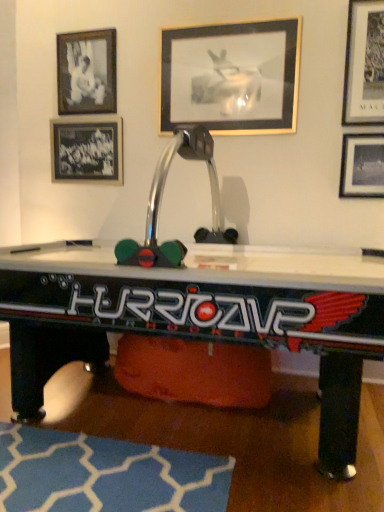
The height and width of the screenshot is (512, 384). Find the location of `metallic silver picture frame at upper right, which is the 2th picture frame in right-to-left order`. metallic silver picture frame at upper right, which is the 2th picture frame in right-to-left order is located at coordinates (364, 64).

Based on the photo, what is the approximate width of metallic silver air hockey table at center?

4.19 feet.

Find the location of a particular element. This screenshot has height=512, width=384. metallic silver air hockey table at center is located at coordinates (198, 316).

Measure the distance between metallic silver picture frame at upper center, the 3th picture frame when ordered from right to left, and camera.

A distance of 2.46 meters exists between metallic silver picture frame at upper center, the 3th picture frame when ordered from right to left, and camera.

Image resolution: width=384 pixels, height=512 pixels. I want to click on metallic silver picture frame at upper right, positioned as the 4th picture frame in left-to-right order, so click(x=364, y=64).

Does point (80, 479) lie behind point (54, 129)?

No, (80, 479) is in front of (54, 129).

Would you say blue fabric rug at lower center is outside black glass picture frame at upper left, the 1th picture frame when ordered from left to right?

Yes, blue fabric rug at lower center is not within black glass picture frame at upper left, the 1th picture frame when ordered from left to right.

Is blue fabric rug at lower center next to black glass picture frame at upper left, the 1th picture frame when ordered from left to right?

blue fabric rug at lower center and black glass picture frame at upper left, the 1th picture frame when ordered from left to right, are not in contact.

At what (x,y) coordinates should I click in order to perform the action: click on the 2nd picture frame above the blue fabric rug at lower center (from the image's perspective). Please return your answer as a coordinate pair (x, y). The height and width of the screenshot is (512, 384). Looking at the image, I should click on (87, 148).

Considering the positions of objects metallic silver air hockey table at center and black glass picture frame at upper left, the 1th picture frame when ordered from left to right, in the image provided, who is more to the left, metallic silver air hockey table at center or black glass picture frame at upper left, the 1th picture frame when ordered from left to right,?

From the viewer's perspective, black glass picture frame at upper left, the 1th picture frame when ordered from left to right, appears more on the left side.

Is black glass picture frame at upper left, marked as the 5th picture frame in a right-to-left arrangement, completely or partially inside metallic silver air hockey table at center?

Yes, black glass picture frame at upper left, marked as the 5th picture frame in a right-to-left arrangement, is a part of metallic silver air hockey table at center.

Is black glass picture frame at upper left, the 1th picture frame when ordered from left to right, at the back of metallic silver air hockey table at center?

Absolutely, metallic silver air hockey table at center is directed away from black glass picture frame at upper left, the 1th picture frame when ordered from left to right.

Does metallic silver air hockey table at center come behind black glass picture frame at upper left, marked as the 5th picture frame in a right-to-left arrangement?

No, it is not.

Find the location of `table on the right of black matte photo frame at upper left, positioned as the 2th picture frame in left-to-right order`. table on the right of black matte photo frame at upper left, positioned as the 2th picture frame in left-to-right order is located at coordinates click(x=198, y=316).

In terms of width, does black matte photo frame at upper left, the fourth picture frame when ordered from right to left, look wider or thinner when compared to metallic silver air hockey table at center?

Considering their sizes, black matte photo frame at upper left, the fourth picture frame when ordered from right to left, looks slimmer than metallic silver air hockey table at center.

Is black matte photo frame at upper left, the fourth picture frame when ordered from right to left, touching metallic silver air hockey table at center?

No, black matte photo frame at upper left, the fourth picture frame when ordered from right to left, is not next to metallic silver air hockey table at center.

Could you tell me if black matte photo frame at upper left, positioned as the 2th picture frame in left-to-right order, is turned towards metallic silver air hockey table at center?

No, black matte photo frame at upper left, positioned as the 2th picture frame in left-to-right order, is not turned towards metallic silver air hockey table at center.

Between metallic silver picture frame at upper right, marked as the 5th picture frame in a left-to-right arrangement, and metallic silver picture frame at upper center, the 3th picture frame when ordered from right to left, which one has larger size?

With larger size is metallic silver picture frame at upper center, the 3th picture frame when ordered from right to left.

What's the angular difference between metallic silver picture frame at upper right, placed as the 1th picture frame when sorted from right to left, and metallic silver picture frame at upper center, the third picture frame when ordered from left to right,'s facing directions?

They differ by 0.016 degrees in their facing directions.

Considering the positions of objects metallic silver picture frame at upper right, placed as the 1th picture frame when sorted from right to left, and metallic silver picture frame at upper center, the 3th picture frame when ordered from right to left, in the image provided, who is more to the right, metallic silver picture frame at upper right, placed as the 1th picture frame when sorted from right to left, or metallic silver picture frame at upper center, the 3th picture frame when ordered from right to left,?

Positioned to the right is metallic silver picture frame at upper right, placed as the 1th picture frame when sorted from right to left.

Where is `the 1st picture frame behind the metallic silver picture frame at upper right, placed as the 1th picture frame when sorted from right to left, counting from the anchor's position`? the 1st picture frame behind the metallic silver picture frame at upper right, placed as the 1th picture frame when sorted from right to left, counting from the anchor's position is located at coordinates (232, 77).

In the image, is metallic silver picture frame at upper center, the third picture frame when ordered from left to right, on the left side or the right side of black matte photo frame at upper left, positioned as the 2th picture frame in left-to-right order?

From the image, it's evident that metallic silver picture frame at upper center, the third picture frame when ordered from left to right, is to the right of black matte photo frame at upper left, positioned as the 2th picture frame in left-to-right order.

Which of these two, metallic silver picture frame at upper center, the third picture frame when ordered from left to right, or black matte photo frame at upper left, positioned as the 2th picture frame in left-to-right order, is bigger?

With larger size is metallic silver picture frame at upper center, the third picture frame when ordered from left to right.

From a real-world perspective, is metallic silver picture frame at upper center, the 3th picture frame when ordered from right to left, positioned under black matte photo frame at upper left, positioned as the 2th picture frame in left-to-right order, based on gravity?

Yes, from a real-world perspective, metallic silver picture frame at upper center, the 3th picture frame when ordered from right to left, is beneath black matte photo frame at upper left, positioned as the 2th picture frame in left-to-right order.

Would you say metallic silver picture frame at upper center, the third picture frame when ordered from left to right, is a long distance from black matte photo frame at upper left, positioned as the 2th picture frame in left-to-right order?

No, metallic silver picture frame at upper center, the third picture frame when ordered from left to right, is not far from black matte photo frame at upper left, positioned as the 2th picture frame in left-to-right order.

Is black glass picture frame at upper left, the 1th picture frame when ordered from left to right, far away from metallic silver picture frame at upper center, the third picture frame when ordered from left to right?

That's not correct — black glass picture frame at upper left, the 1th picture frame when ordered from left to right, is a little close to metallic silver picture frame at upper center, the third picture frame when ordered from left to right.

Does black glass picture frame at upper left, marked as the 5th picture frame in a right-to-left arrangement, have a greater height compared to metallic silver picture frame at upper center, the 3th picture frame when ordered from right to left?

No.

From a real-world perspective, who is located higher, black glass picture frame at upper left, marked as the 5th picture frame in a right-to-left arrangement, or metallic silver picture frame at upper center, the third picture frame when ordered from left to right?

In real-world perspective, metallic silver picture frame at upper center, the third picture frame when ordered from left to right, is above.

From the picture: Is black glass picture frame at upper left, the 1th picture frame when ordered from left to right, closer to camera compared to metallic silver picture frame at upper center, the third picture frame when ordered from left to right?

No, black glass picture frame at upper left, the 1th picture frame when ordered from left to right, is further to the viewer.

Is metallic silver air hockey table at center thinner than black matte photo frame at upper left, the fourth picture frame when ordered from right to left?

No, metallic silver air hockey table at center is not thinner than black matte photo frame at upper left, the fourth picture frame when ordered from right to left.

Locate an element on the screen. This screenshot has width=384, height=512. the 1st picture frame to the left of the metallic silver air hockey table at center, counting from the anchor's position is located at coordinates (87, 72).

Is metallic silver air hockey table at center taller or shorter than black matte photo frame at upper left, the fourth picture frame when ordered from right to left?

metallic silver air hockey table at center is taller than black matte photo frame at upper left, the fourth picture frame when ordered from right to left.

Is point (311, 340) behind point (91, 59)?

No, it is not.

From a real-world perspective, count 2nd picture frames upward from the blue fabric rug at lower center and point to it. Please provide its 2D coordinates.

[(87, 148)]

The image size is (384, 512). Identify the location of table in front of the black glass picture frame at upper left, marked as the 5th picture frame in a right-to-left arrangement. (198, 316).

Based on their spatial positions, is black matte photo frame at upper left, positioned as the 2th picture frame in left-to-right order, or metallic silver picture frame at upper right, placed as the 1th picture frame when sorted from right to left, closer to blue fabric rug at lower center?

metallic silver picture frame at upper right, placed as the 1th picture frame when sorted from right to left, is closer to blue fabric rug at lower center.

Based on the photo, when comparing their distances from metallic silver picture frame at upper center, the 3th picture frame when ordered from right to left, does metallic silver air hockey table at center or metallic silver picture frame at upper right, which is the 2th picture frame in right-to-left order, seem further?

metallic silver air hockey table at center.

From the picture: Based on their spatial positions, is metallic silver air hockey table at center or metallic silver picture frame at upper right, placed as the 1th picture frame when sorted from right to left, further from blue fabric rug at lower center?

Based on the image, metallic silver picture frame at upper right, placed as the 1th picture frame when sorted from right to left, appears to be further to blue fabric rug at lower center.

Considering their positions, is metallic silver picture frame at upper right, positioned as the 4th picture frame in left-to-right order, positioned further to metallic silver air hockey table at center than blue fabric rug at lower center?

The object further to metallic silver air hockey table at center is metallic silver picture frame at upper right, positioned as the 4th picture frame in left-to-right order.

Considering their positions, is black glass picture frame at upper left, marked as the 5th picture frame in a right-to-left arrangement, positioned closer to blue fabric rug at lower center than metallic silver picture frame at upper right, positioned as the 4th picture frame in left-to-right order?

black glass picture frame at upper left, marked as the 5th picture frame in a right-to-left arrangement, is closer to blue fabric rug at lower center.

Estimate the real-world distances between objects in this image. Which object is closer to black glass picture frame at upper left, the 1th picture frame when ordered from left to right, black matte photo frame at upper left, the fourth picture frame when ordered from right to left, or metallic silver picture frame at upper center, the third picture frame when ordered from left to right?

The object closer to black glass picture frame at upper left, the 1th picture frame when ordered from left to right, is black matte photo frame at upper left, the fourth picture frame when ordered from right to left.

Estimate the real-world distances between objects in this image. Which object is closer to metallic silver picture frame at upper right, which is the 2th picture frame in right-to-left order, black glass picture frame at upper left, marked as the 5th picture frame in a right-to-left arrangement, or metallic silver air hockey table at center?

metallic silver air hockey table at center is positioned closer to the anchor metallic silver picture frame at upper right, which is the 2th picture frame in right-to-left order.

Which object lies further to the anchor point metallic silver picture frame at upper right, which is the 2th picture frame in right-to-left order, black glass picture frame at upper left, marked as the 5th picture frame in a right-to-left arrangement, or metallic silver picture frame at upper right, placed as the 1th picture frame when sorted from right to left?

black glass picture frame at upper left, marked as the 5th picture frame in a right-to-left arrangement, is positioned further to the anchor metallic silver picture frame at upper right, which is the 2th picture frame in right-to-left order.

This screenshot has width=384, height=512. In order to click on table between black matte photo frame at upper left, positioned as the 2th picture frame in left-to-right order, and blue fabric rug at lower center vertically in this screenshot , I will do click(x=198, y=316).

The width and height of the screenshot is (384, 512). I want to click on table located between black glass picture frame at upper left, the 1th picture frame when ordered from left to right, and metallic silver picture frame at upper right, placed as the 1th picture frame when sorted from right to left, in the left-right direction, so click(198, 316).

This screenshot has width=384, height=512. In order to click on mat between black glass picture frame at upper left, marked as the 5th picture frame in a right-to-left arrangement, and metallic silver picture frame at upper right, placed as the 1th picture frame when sorted from right to left, from left to right in this screenshot , I will do `click(105, 475)`.

The height and width of the screenshot is (512, 384). In order to click on table between metallic silver picture frame at upper center, the 3th picture frame when ordered from right to left, and blue fabric rug at lower center in the up-down direction in this screenshot , I will do `click(198, 316)`.